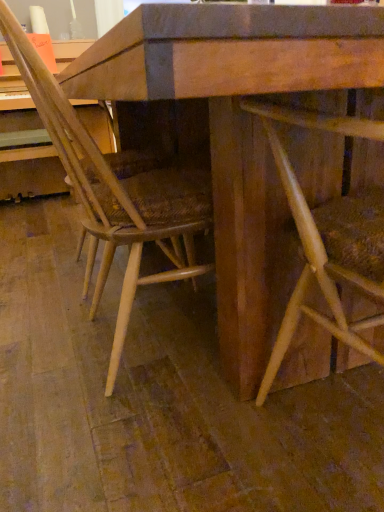
Question: Is natural wood chair at center, which is the second chair from left to right, not within natural wood chair at center, which is counted as the second chair, starting from the right?

Choices:
 (A) no
 (B) yes

Answer: (B)

Question: Is natural wood chair at center, which is counted as the second chair, starting from the right, surrounded by natural wood chair at center, placed as the 1th chair when sorted from right to left?

Choices:
 (A) no
 (B) yes

Answer: (A)

Question: Are natural wood chair at center, which is the second chair from left to right, and natural wood chair at center, which is counted as the second chair, starting from the right, far apart?

Choices:
 (A) yes
 (B) no

Answer: (B)

Question: From a real-world perspective, is natural wood chair at center, placed as the 1th chair when sorted from right to left, physically below natural wood chair at center, the first chair in the left-to-right sequence?

Choices:
 (A) no
 (B) yes

Answer: (B)

Question: From a real-world perspective, is natural wood chair at center, which is the second chair from left to right, positioned over natural wood chair at center, the first chair in the left-to-right sequence, based on gravity?

Choices:
 (A) yes
 (B) no

Answer: (B)

Question: Considering the relative sizes of natural wood chair at center, placed as the 1th chair when sorted from right to left, and natural wood chair at center, the first chair in the left-to-right sequence, in the image provided, is natural wood chair at center, placed as the 1th chair when sorted from right to left, smaller than natural wood chair at center, the first chair in the left-to-right sequence,?

Choices:
 (A) yes
 (B) no

Answer: (A)

Question: Is natural wood chair at center, the first chair in the left-to-right sequence, aimed at natural wood chair at center, which is the second chair from left to right?

Choices:
 (A) no
 (B) yes

Answer: (A)

Question: From the image's perspective, is natural wood chair at center, the first chair in the left-to-right sequence, beneath natural wood chair at center, which is the second chair from left to right?

Choices:
 (A) no
 (B) yes

Answer: (A)

Question: Is natural wood chair at center, the first chair in the left-to-right sequence, at the left side of natural wood chair at center, placed as the 1th chair when sorted from right to left?

Choices:
 (A) no
 (B) yes

Answer: (B)

Question: Can you confirm if natural wood chair at center, which is counted as the second chair, starting from the right, is thinner than natural wood chair at center, which is the second chair from left to right?

Choices:
 (A) yes
 (B) no

Answer: (B)

Question: Considering the relative sizes of natural wood chair at center, the first chair in the left-to-right sequence, and natural wood chair at center, which is the second chair from left to right, in the image provided, is natural wood chair at center, the first chair in the left-to-right sequence, wider than natural wood chair at center, which is the second chair from left to right,?

Choices:
 (A) no
 (B) yes

Answer: (B)

Question: Is natural wood chair at center, the first chair in the left-to-right sequence, in front of natural wood chair at center, placed as the 1th chair when sorted from right to left?

Choices:
 (A) no
 (B) yes

Answer: (A)

Question: Would you say natural wood chair at center, which is counted as the second chair, starting from the right, is to the left or to the right of natural wood chair at center, placed as the 1th chair when sorted from right to left, in the picture?

Choices:
 (A) right
 (B) left

Answer: (B)